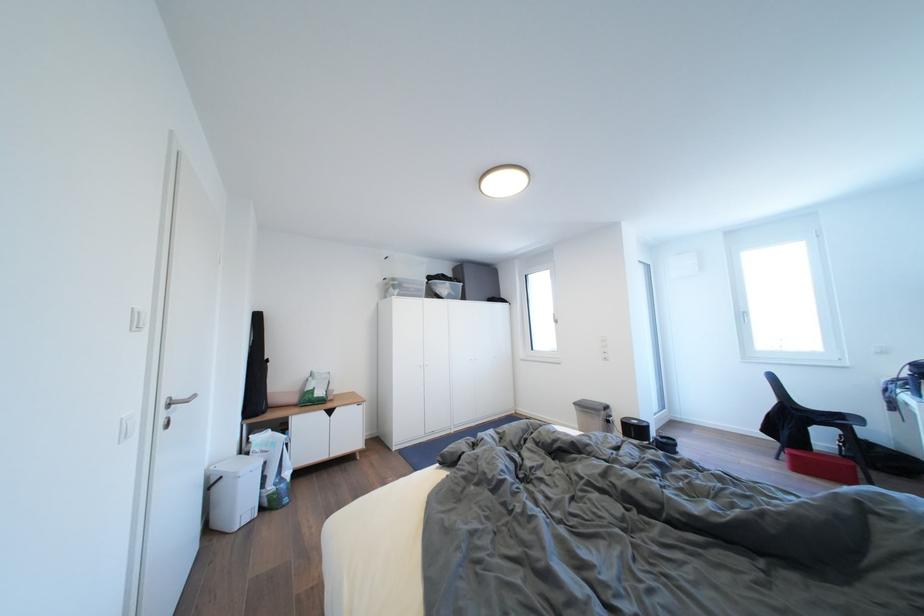
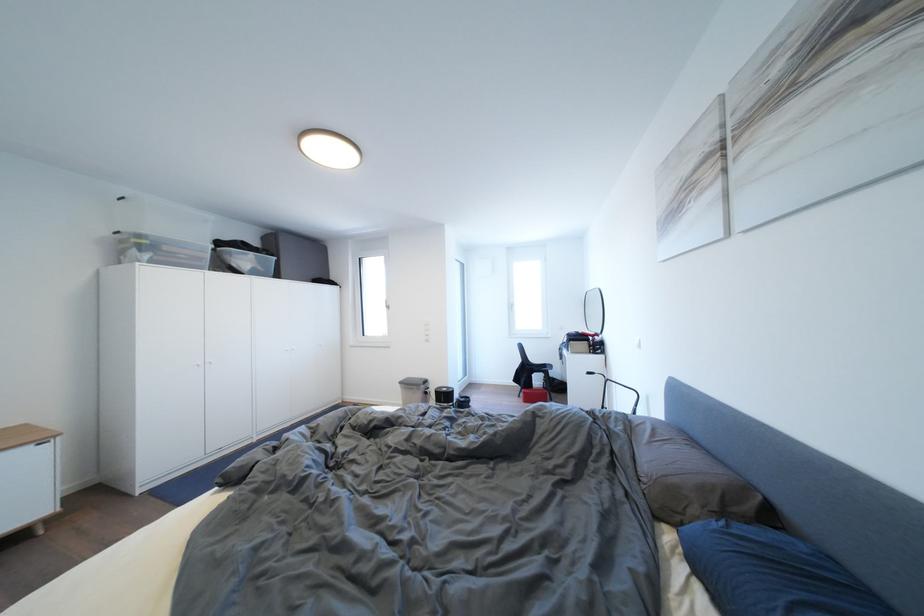
In the second image, find the point that corresponds to point 402,285 in the first image.

(149, 241)